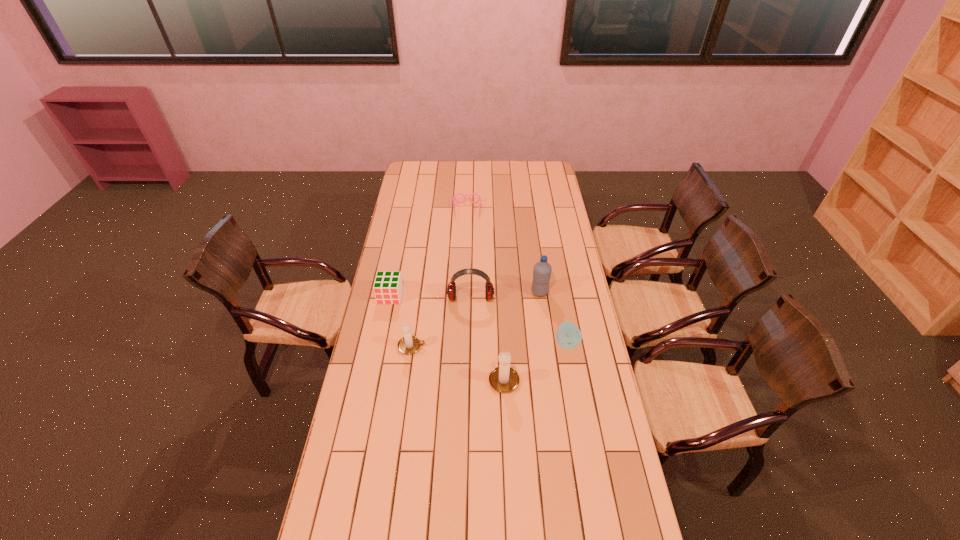
Locate an element on the screen. vacant spot to place a candle holder on the right is located at coordinates (609, 415).